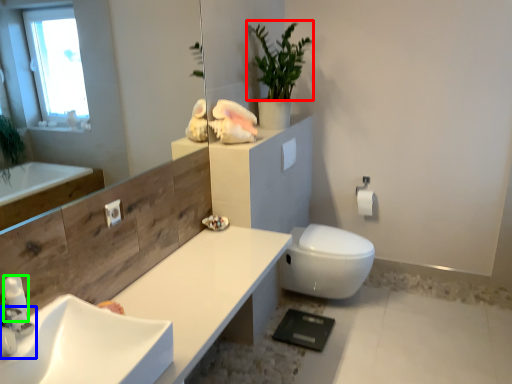
Question: Considering the real-world distances, which object is farthest from plant (highlighted by a red box)? tap (highlighted by a blue box) or soap dispenser (highlighted by a green box)?

Choices:
 (A) tap
 (B) soap dispenser

Answer: (A)